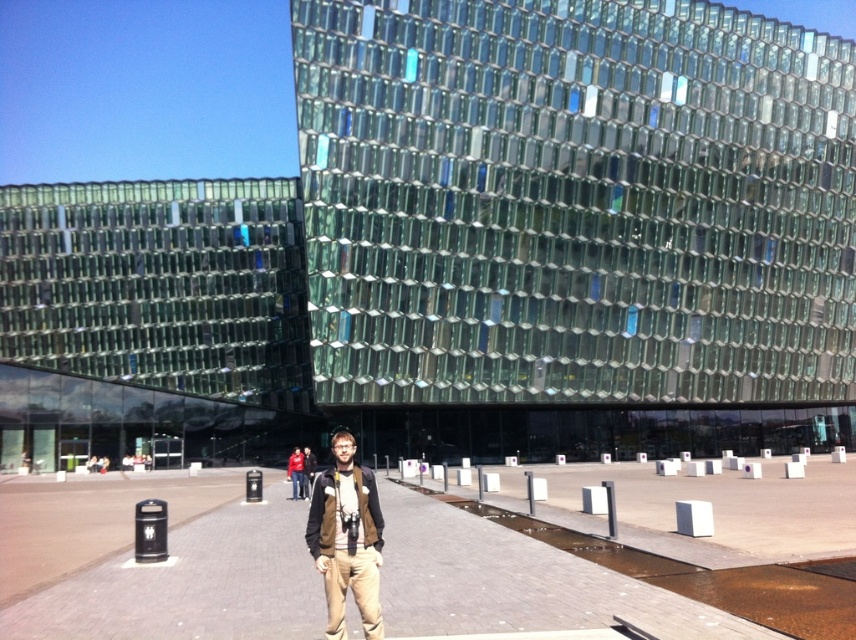
Is brick pavement at center closer to camera compared to brown leather jacket at center?

That is False.

Locate an element on the screen. Image resolution: width=856 pixels, height=640 pixels. brick pavement at center is located at coordinates tap(516, 584).